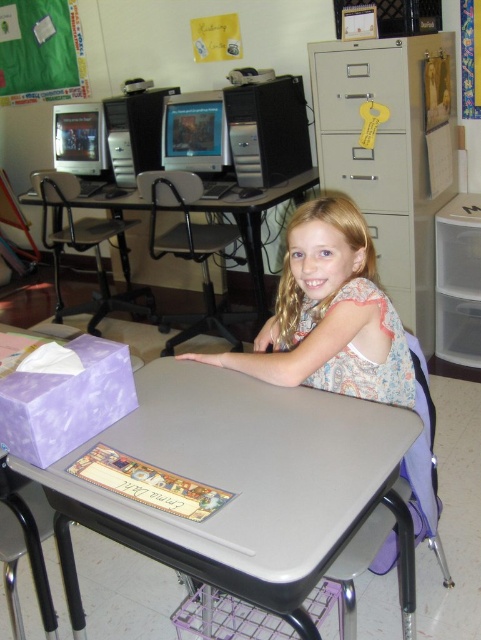
You are standing in the classroom and want to place a new monitor on the desk where the point is located. Is the desk at point (x=242, y=477) large enough to accommodate the monitor?

The desk at point (x=242, y=477) is a standard school desk with a gray top, so it should have sufficient space to place a new monitor.